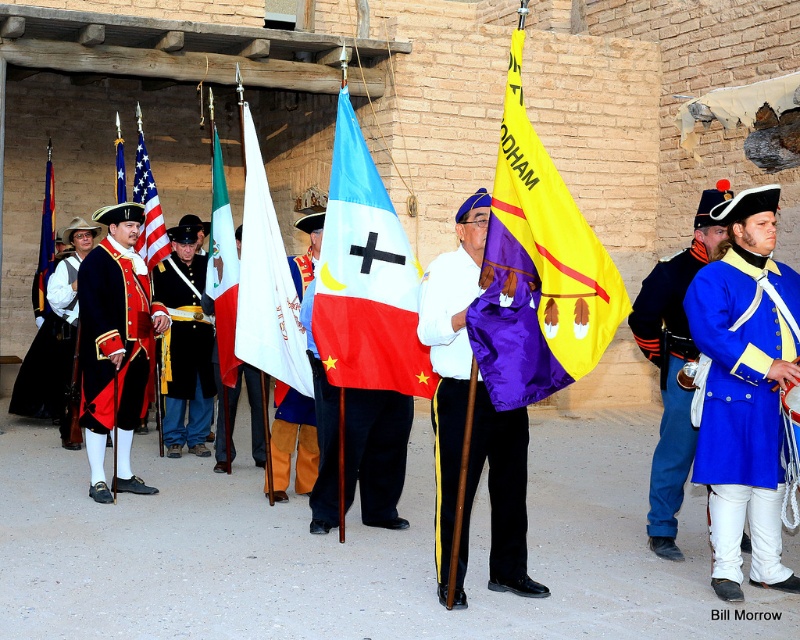
Question: Where is velvet red coat at left located in relation to brushed metal uniform at left in the image?

Choices:
 (A) above
 (B) below

Answer: (A)

Question: Is blue wool coat at right thinner than black velvet coat at left?

Choices:
 (A) yes
 (B) no

Answer: (A)

Question: Which point is farther to the camera?

Choices:
 (A) (310, 392)
 (B) (190, 262)
 (C) (218, 320)
 (D) (516, 212)

Answer: (B)

Question: Does blue wool coat at center appear under blue wool coat at right?

Choices:
 (A) yes
 (B) no

Answer: (A)

Question: Which of the following is the closest to the observer?

Choices:
 (A) (418, 385)
 (B) (52, 177)
 (C) (272, 269)

Answer: (A)

Question: Estimate the real-world distances between objects in this image. Which object is farther from the brushed metal uniform at left?

Choices:
 (A) blue fabric flag with white cross at center
 (B) matte black flag at center

Answer: (A)